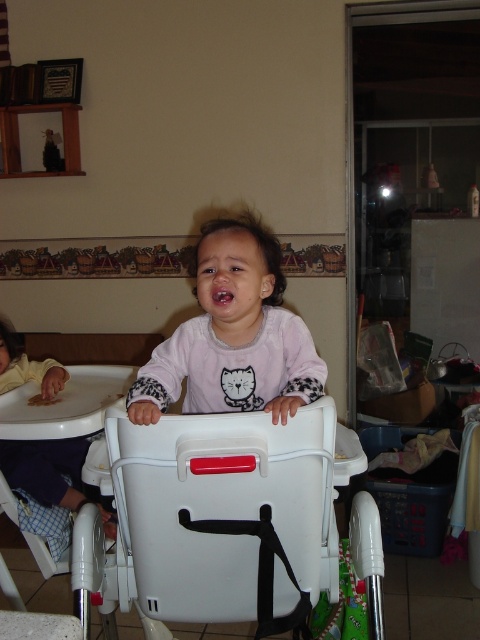
You are a parent in a kitchen. You see the white plastic baby carriage at center and the purple soft baby at left. Which one is closer to the left side of the room?

The purple soft baby at left is closer to the left side of the room because it is positioned to the left of the white plastic baby carriage at center.

From the picture: You are a parent trying to place a white plastic baby carriage at center and a pink matte shirt at center in the same area. Based on the scene, which object is located to the left of the other?

The white plastic baby carriage at center is positioned on the left side of pink matte shirt at center.